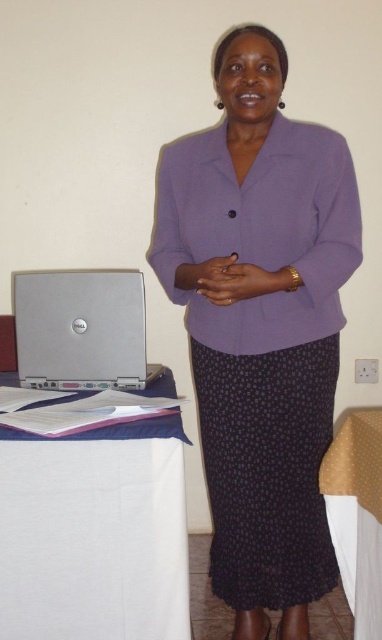
You are organizing a meeting and need to place a 12 inch by 10 inch presentation folder on the table. Given the silver metallic laptop at lower left and the gold fabric tablecloth at lower right, which object can accommodate the folder without overlapping?

The silver metallic laptop at lower left has a larger size compared to the gold fabric tablecloth at lower right, so the folder can be placed on the silver metallic laptop at lower left without overlapping.